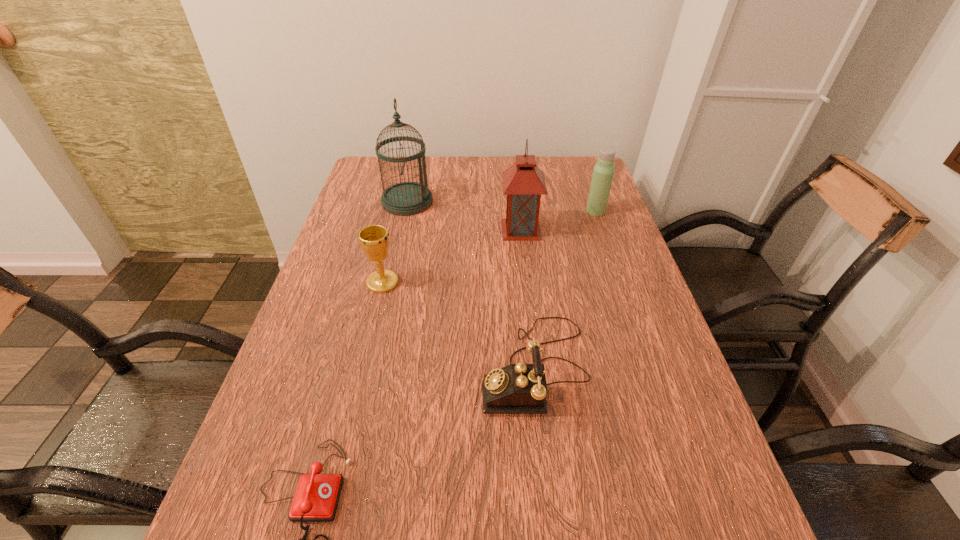
The image size is (960, 540). What are the coordinates of `birdcage` in the screenshot? It's located at (408, 198).

Where is `lantern`? The height and width of the screenshot is (540, 960). lantern is located at coordinates (523, 183).

Locate an element on the screen. Image resolution: width=960 pixels, height=540 pixels. the fifth nearest object is located at coordinates (523, 183).

Locate an element on the screen. This screenshot has width=960, height=540. thermos bottle is located at coordinates (603, 172).

At what (x,y) coordinates should I click in order to perform the action: click on the rightmost object. Please return your answer as a coordinate pair (x, y). This screenshot has width=960, height=540. Looking at the image, I should click on (603, 172).

Where is `chalice`? The image size is (960, 540). chalice is located at coordinates (374, 239).

Locate an element on the screen. The image size is (960, 540). the fourth tallest object is located at coordinates [x=374, y=239].

Where is `the taller telephone`? the taller telephone is located at coordinates (520, 388).

The width and height of the screenshot is (960, 540). What are the coordinates of `the third shortest object` in the screenshot? It's located at (520, 388).

This screenshot has width=960, height=540. I want to click on vacant space located on the front-facing side of the birdcage, so [451, 201].